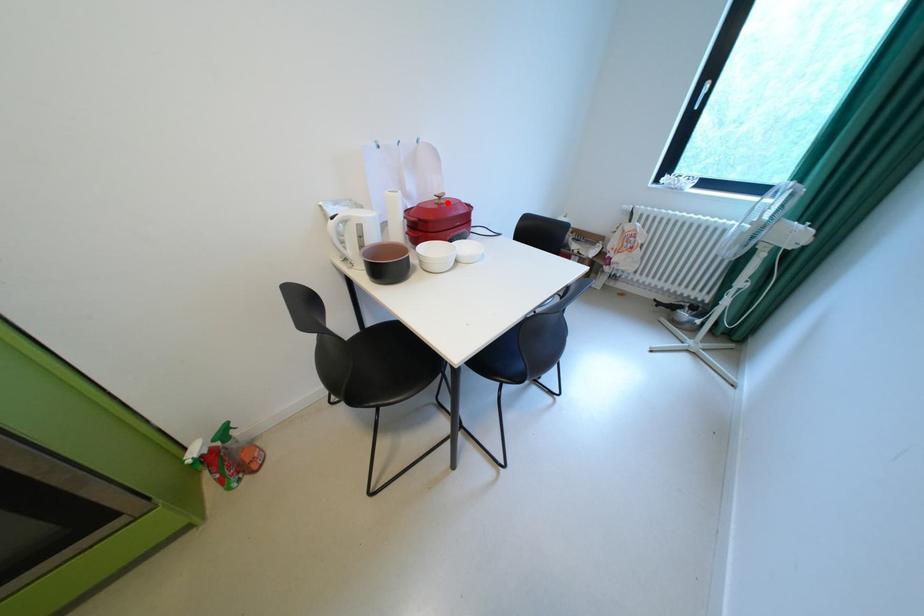
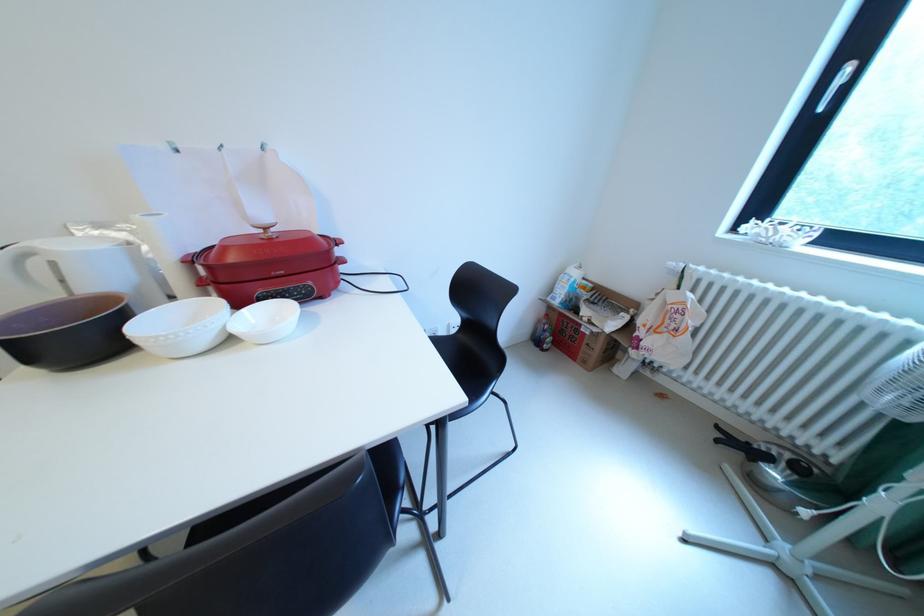
Find the pixel in the second image that matches the highlighted location in the first image.

(273, 237)